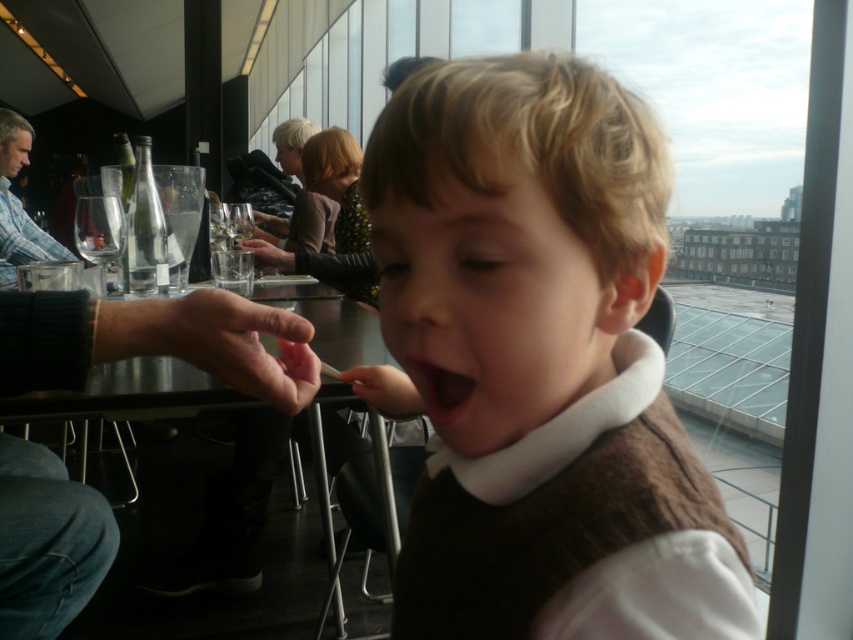
You are a waiter in the restaurant and need to deliver a drink to a customer. You are currently at point (7,204) and the customer is at point (430,392). Which point is closer to you?

Point (7,204) is further to the viewer than point (430,392), so the customer at point (430,392) is closer to you.

What is located at the coordinates point (438, 388) in the image?

The point (438, 388) marks the black matte mouth at center.